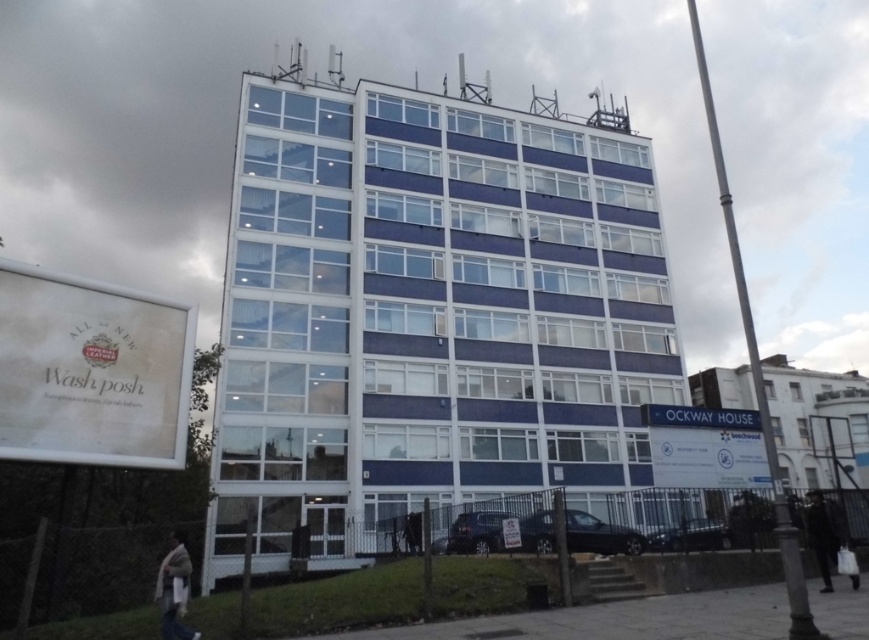
Question: Can you confirm if beige knitted scarf at lower left is smaller than dark wool coat at lower right?

Choices:
 (A) no
 (B) yes

Answer: (B)

Question: Observing the image, what is the correct spatial positioning of beige knitted scarf at lower left in reference to dark wool coat at lower right?

Choices:
 (A) above
 (B) below

Answer: (A)

Question: Which object is closer to the camera taking this photo?

Choices:
 (A) beige knitted scarf at lower left
 (B) dark wool coat at lower right

Answer: (A)

Question: Which object appears farthest from the camera in this image?

Choices:
 (A) beige knitted scarf at lower left
 (B) dark wool coat at lower right

Answer: (B)

Question: Does beige knitted scarf at lower left appear under dark wool coat at lower right?

Choices:
 (A) no
 (B) yes

Answer: (A)